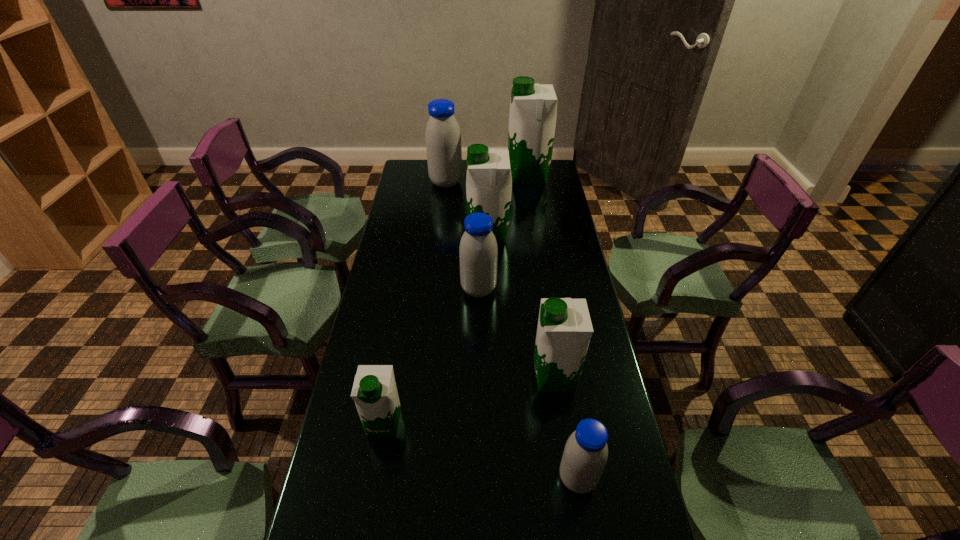
Identify which soya milk is the fifth nearest to the smallest green soya milk. Please provide its 2D coordinates. Your answer should be formatted as a tuple, i.e. [(x, y)], where the tuple contains the x and y coordinates of a point satisfying the conditions above.

[(443, 137)]

Select which soya milk is the closest to the second biggest green soya milk. Please provide its 2D coordinates. Your answer should be formatted as a tuple, i.e. [(x, y)], where the tuple contains the x and y coordinates of a point satisfying the conditions above.

[(478, 252)]

This screenshot has height=540, width=960. What are the coordinates of `green soya milk that is the closest to the second farthest green soya milk` in the screenshot? It's located at (533, 107).

Locate which green soya milk ranks second in proximity to the third nearest green soya milk. Please provide its 2D coordinates. Your answer should be formatted as a tuple, i.e. [(x, y)], where the tuple contains the x and y coordinates of a point satisfying the conditions above.

[(564, 330)]

Locate an element on the screen. The height and width of the screenshot is (540, 960). the second closest blue soya milk to the leftmost blue soya milk is located at coordinates pyautogui.click(x=585, y=455).

Locate an element on the screen. The image size is (960, 540). blue soya milk that is the second closest to the biggest blue soya milk is located at coordinates (585, 455).

I want to click on free space that satisfies the following two spatial constraints: 1. on the front-facing side of the smallest blue soya milk; 2. on the right side of the sixth farthest object, so click(x=375, y=478).

Locate an element on the screen. vacant space that satisfies the following two spatial constraints: 1. on the front-facing side of the fifth farthest soya milk; 2. on the right side of the nearest object is located at coordinates (570, 478).

You are a GUI agent. You are given a task and a screenshot of the screen. Output one action in this format:
    pyautogui.click(x=<x>, y=<y>)
    Task: Click on the free spot that satisfies the following two spatial constraints: 1. on the front-facing side of the rightmost blue soya milk; 2. on the left side of the tallest soya milk
    
    Given the screenshot: What is the action you would take?
    pyautogui.click(x=574, y=478)

At what (x,y) coordinates should I click in order to perform the action: click on vacant point that satisfies the following two spatial constraints: 1. on the front-facing side of the second green soya milk from left to right; 2. on the front-facing side of the second nearest soya milk. Please return your answer as a coordinate pair (x, y). Looking at the image, I should click on pyautogui.click(x=492, y=423).